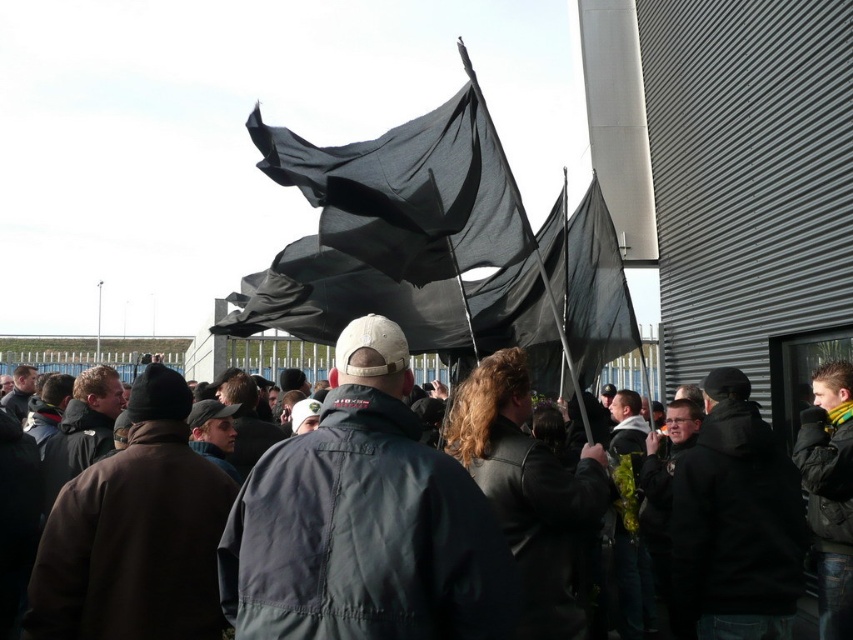
You are a photographer trying to capture a clear shot of the black fabric flag at center and the black fabric flags at center. Which one would be easier to focus on due to its height?

The black fabric flag at center is much taller than the black fabric flags at center, so it would be easier to focus on due to its height.

You are a photographer trying to capture a clear image of the dark gray jacket at center and the black fabric flag at center. Which object should you focus on first if you want to ensure both are in focus, considering their sizes?

The dark gray jacket at center is larger in size than the black fabric flag at center, so you should focus on the dark gray jacket at center first to ensure both are in focus.

You are a photographer trying to capture a clear shot of the dark gray jacket at center and the black fabric flag at center. Since the wind is strong, you want to ensure both are in focus. Which object should you focus on first to make sure it is sharp in the photo?

You should focus on the dark gray jacket at center first because it is closer to the viewer than the black fabric flag at center, so adjusting focus starting from the closer object ensures both will be in focus when using depth of field properly.